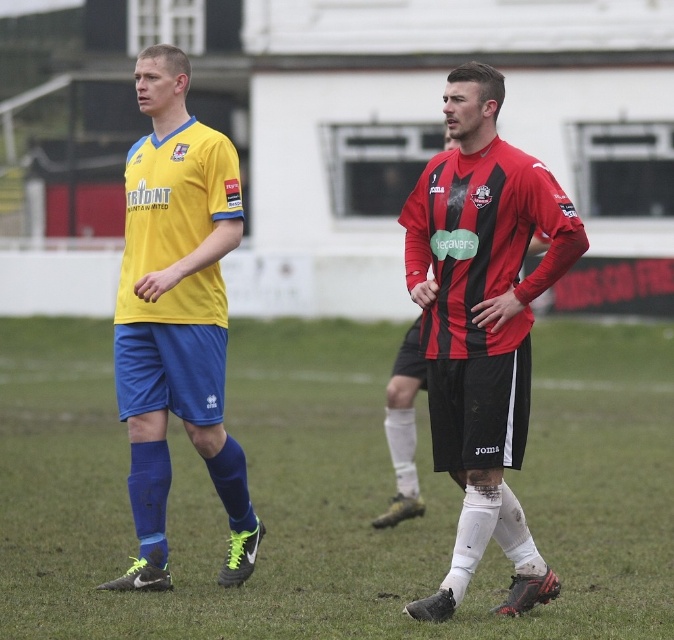
You are a photographer trying to capture a closeup of the matte red and black jersey at center. Since the green grass at center is in the way, can you adjust your camera angle to focus on the jersey without moving the grass?

The green grass at center is bigger than the matte red and black jersey at center, so adjusting the camera angle might be challenging as the grass could still obstruct the jersey. Consider moving closer or repositioning to ensure the jersey is fully visible.